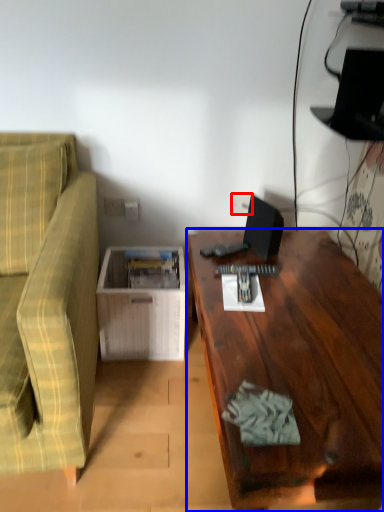
Question: Which point is closer to the camera, electric outlet (highlighted by a red box) or desk (highlighted by a blue box)?

Choices:
 (A) electric outlet
 (B) desk

Answer: (B)